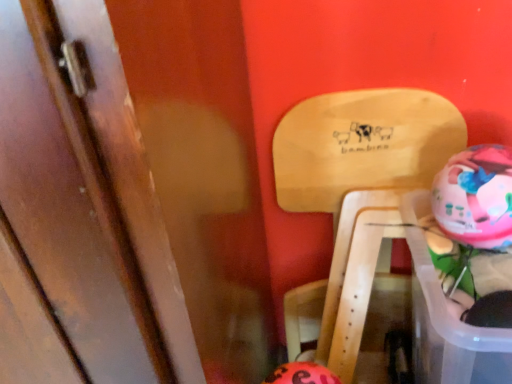
Question: In the image, is multicolored plastic piggy bank at right, which is counted as the 1th piggy bank, starting from the top, positioned in front of or behind orange matte piggy bank at lower center, which is the 2th piggy bank in right-to-left order?

Choices:
 (A) behind
 (B) front

Answer: (B)

Question: Which is correct: multicolored plastic piggy bank at right, which is the 2th piggy bank in bottom-to-top order, is inside orange matte piggy bank at lower center, which is the 2th piggy bank in right-to-left order, or outside of it?

Choices:
 (A) inside
 (B) outside

Answer: (B)

Question: Which of these objects is positioned farthest from the orange matte piggy bank at lower center, which is the 2th piggy bank in right-to-left order?

Choices:
 (A) wooden door at left
 (B) multicolored plastic piggy bank at right, which is the 2th piggy bank in bottom-to-top order
 (C) natural wood chair at upper right

Answer: (A)

Question: Based on their relative distances, which object is nearer to the wooden door at left?

Choices:
 (A) orange matte piggy bank at lower center, the 1th piggy bank when ordered from left to right
 (B) multicolored plastic piggy bank at right, the 2th piggy bank from the left
 (C) natural wood chair at upper right

Answer: (A)